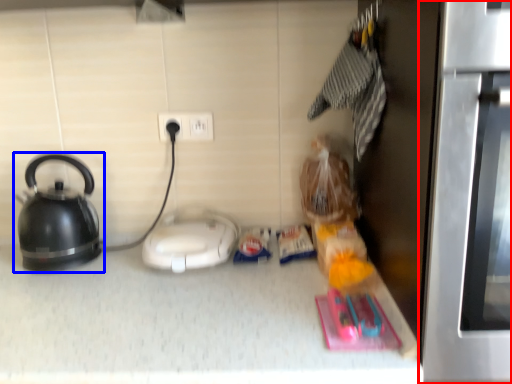
Question: Which of the following is the farthest to the observer, oven (highlighted by a red box) or kettle (highlighted by a blue box)?

Choices:
 (A) oven
 (B) kettle

Answer: (B)